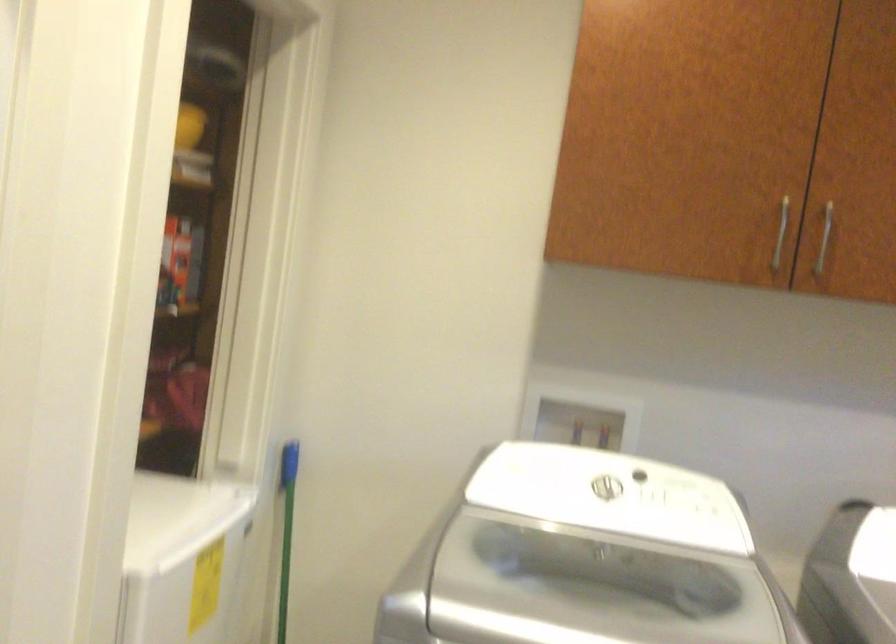
Image resolution: width=896 pixels, height=644 pixels. Describe the element at coordinates (609, 495) in the screenshot. I see `the washing machine lid` at that location.